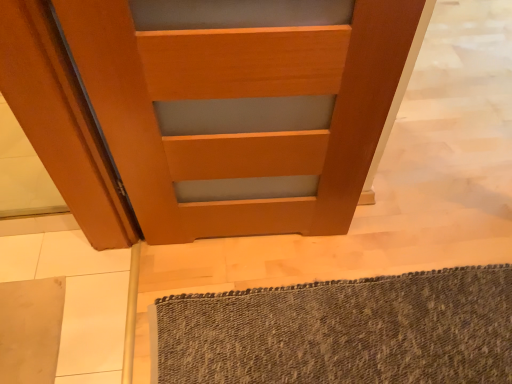
Question: Relative to textured gray bath mat at lower right, is wooden door at center in front or behind?

Choices:
 (A) behind
 (B) front

Answer: (B)

Question: Is wooden door at center to the left or to the right of textured gray bath mat at lower right in the image?

Choices:
 (A) left
 (B) right

Answer: (A)

Question: Is wooden door at center bigger or smaller than textured gray bath mat at lower right?

Choices:
 (A) big
 (B) small

Answer: (A)

Question: Which is correct: textured gray bath mat at lower right is inside wooden door at center, or outside of it?

Choices:
 (A) outside
 (B) inside

Answer: (A)

Question: From the image's perspective, relative to wooden door at center, is textured gray bath mat at lower right above or below?

Choices:
 (A) above
 (B) below

Answer: (B)

Question: From a real-world perspective, relative to wooden door at center, is textured gray bath mat at lower right vertically above or below?

Choices:
 (A) below
 (B) above

Answer: (A)

Question: Considering the positions of textured gray bath mat at lower right and wooden door at center in the image, is textured gray bath mat at lower right wider or thinner than wooden door at center?

Choices:
 (A) thin
 (B) wide

Answer: (B)